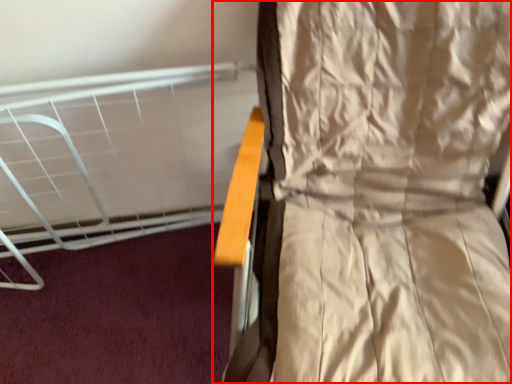
Question: From the image's perspective, what is the correct spatial positioning of curtain (annotated by the red box) in reference to bed?

Choices:
 (A) above
 (B) below

Answer: (B)